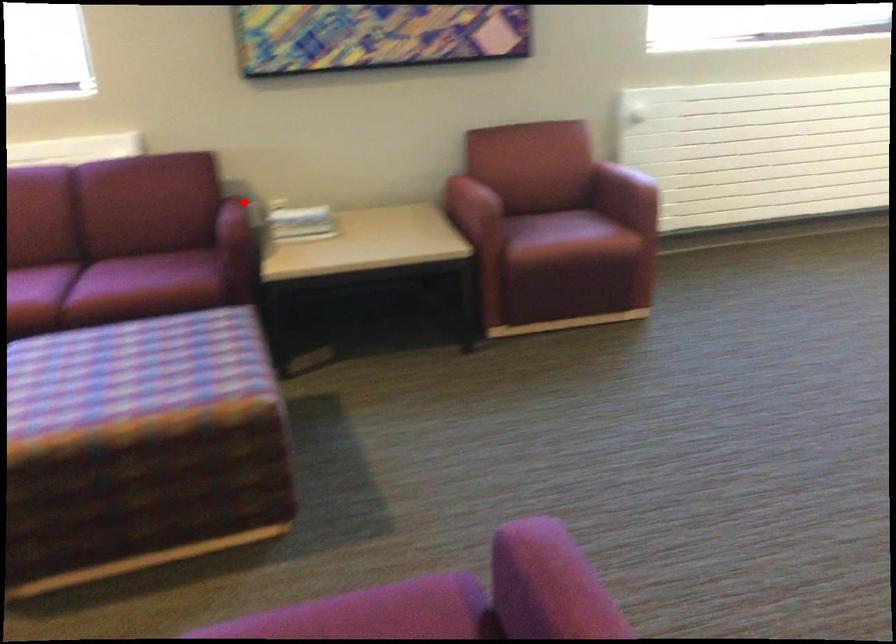
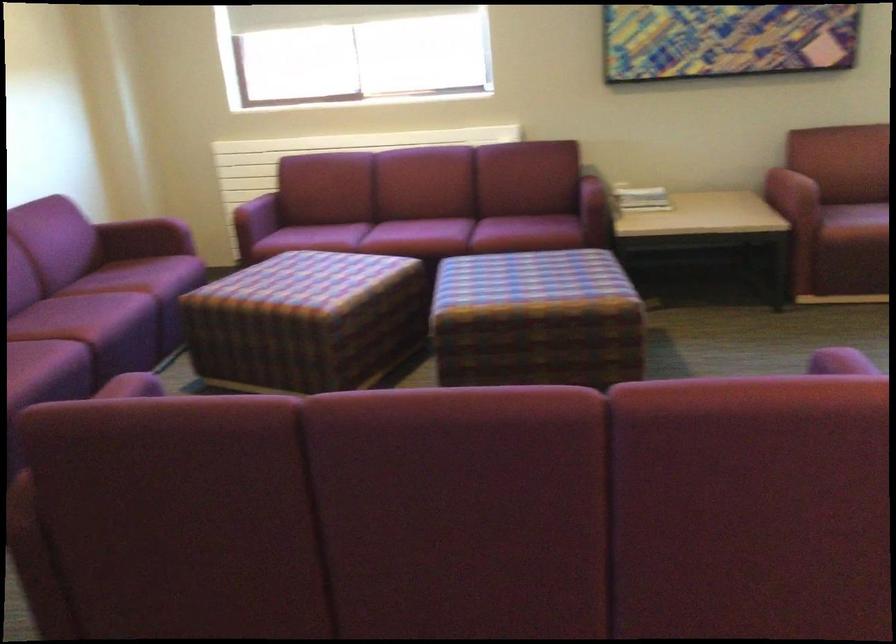
Question: I am providing you with two images of the same scene from different viewpoints. In image1, a red point is highlighted. Considering the same 3D point in image2, which of the following is correct?

Choices:
 (A) It is closer
 (B) It is farther

Answer: (B)